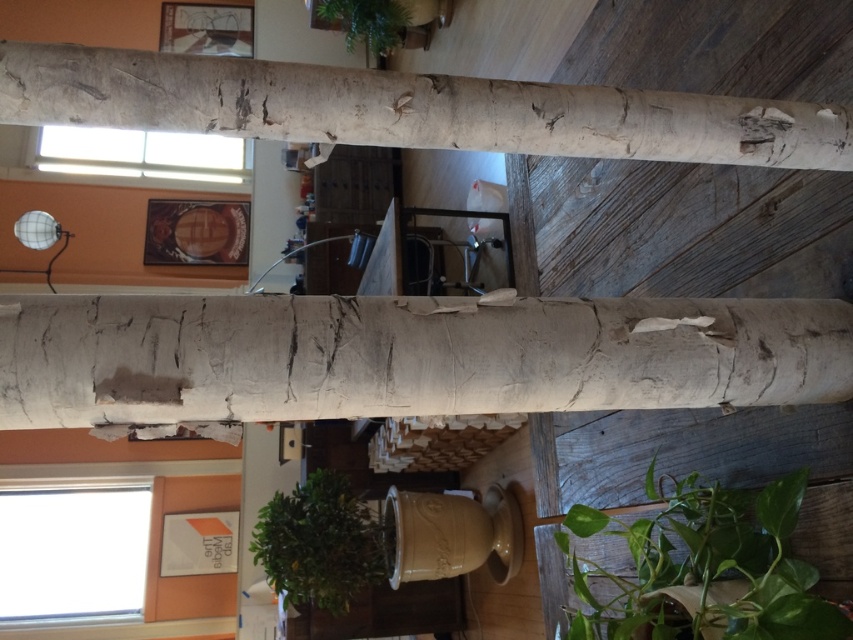
Which is above, white rough bark at center or green leafy plant at upper center?

green leafy plant at upper center is higher up.

Between white rough bark at center and green leafy plant at upper center, which one is positioned lower?

white rough bark at center is below.

Identify the location of white rough bark at center. This screenshot has width=853, height=640. (405, 356).

This screenshot has width=853, height=640. What are the coordinates of `white rough bark at center` in the screenshot? It's located at (405, 356).

Who is more distant from viewer, (758, 131) or (758, 538)?

Positioned behind is point (758, 538).

How far apart are white rough wood beam at upper center and green matte plant at lower right?

They are 24.50 inches apart.

Looking at this image, measure the distance between white rough wood beam at upper center and camera.

white rough wood beam at upper center and camera are 30.89 inches apart.

Image resolution: width=853 pixels, height=640 pixels. In order to click on white rough wood beam at upper center in this screenshot , I will do `click(409, 108)`.

Who is lower down, green matte plant at lower right or green leafy plant at upper center?

Positioned lower is green matte plant at lower right.

The width and height of the screenshot is (853, 640). In order to click on green matte plant at lower right in this screenshot , I will do `click(701, 566)`.